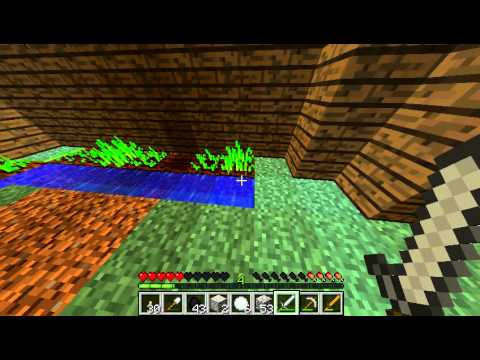
The height and width of the screenshot is (360, 480). I want to click on oak planks, so click(227, 91), click(361, 107), click(424, 141).